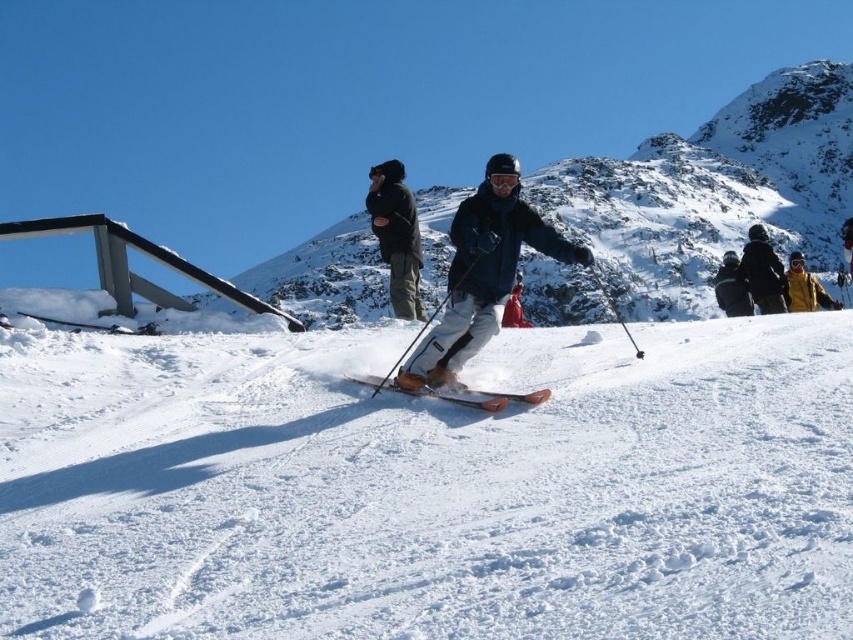
You are a photographer trying to capture a clear photo of both the matte black snowboard at center and the shiny orange ski at center. Which object will appear larger in your photo?

The matte black snowboard at center will appear larger in the photo because it is closer to the viewer than the shiny orange ski at center.

You are a photographer at the ski resort and want to capture both the dark blue jacket at upper right and the matte black jacket at right in a single photo. Which jacket will appear bigger in the photo?

The dark blue jacket at upper right will appear bigger in the photo because it has a larger size compared to the matte black jacket at right.